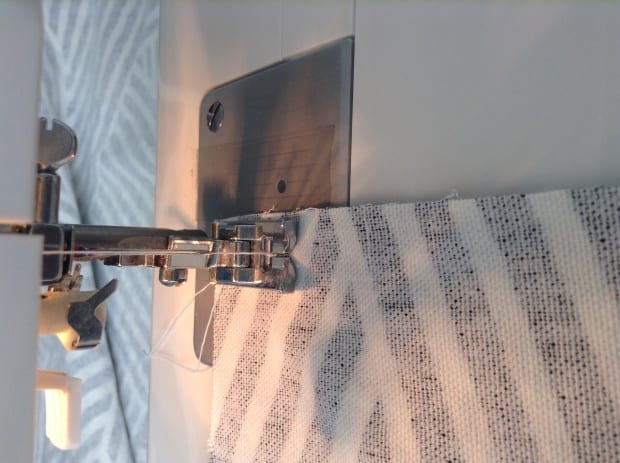
What are the coordinates of `wall` in the screenshot? It's located at (444, 127).